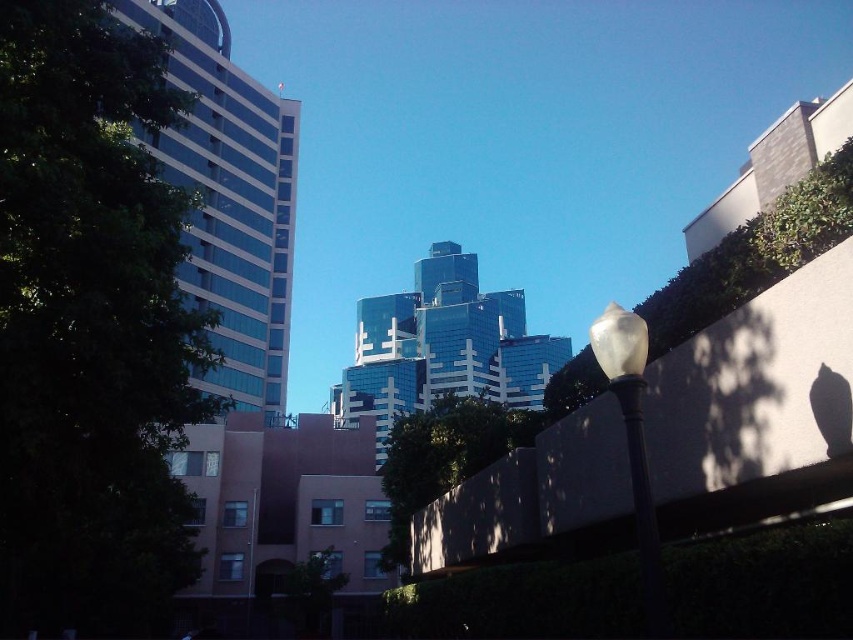
Question: Does concrete wall at center appear on the left side of white frosted glass lamp post at right?

Choices:
 (A) yes
 (B) no

Answer: (A)

Question: Which of the following is the farthest from the observer?

Choices:
 (A) (659, 564)
 (B) (686, 506)

Answer: (B)

Question: Is concrete wall at center below white frosted glass lamp post at right?

Choices:
 (A) no
 (B) yes

Answer: (B)

Question: Is concrete wall at center smaller than white frosted glass lamp post at right?

Choices:
 (A) yes
 (B) no

Answer: (A)